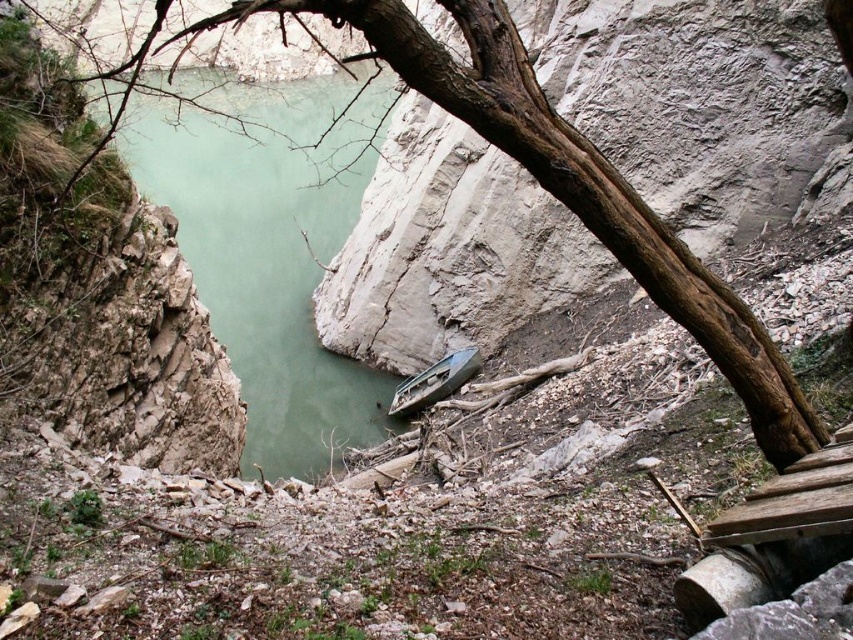
You are standing at the bottom right corner of the image near the wooden structure. You want to reach the green plastic boat at center without crossing the water. Which direction should you walk to first approach the brown rough tree trunk at upper center before reaching the boat?

You should walk towards the upper center direction first to approach the brown rough tree trunk at upper center, which is located to the left of the green plastic boat at center. From there, you can then proceed towards the boat.

You are an environmental scientist assessing the area. You need to determine the visibility of the brown rough tree trunk at upper center from the green smooth water at center. Is the tree trunk visible from the water? Please explain based on their positions.

The brown rough tree trunk at upper center is behind the green smooth water at center, so it would not be visible from the water as it is obscured by the water itself.

Consider the image. You are standing at the edge of the rugged landscape and want to reach the green plastic boat at center. Which direction should you move relative to the green smooth water at center?

To reach the green plastic boat at center, you should move behind the green smooth water at center since the water is in front of the boat.